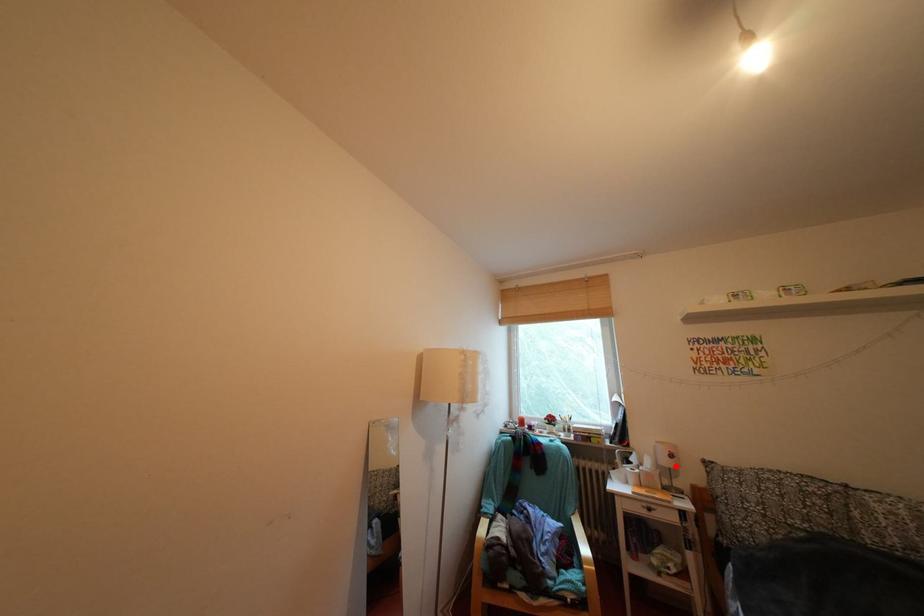
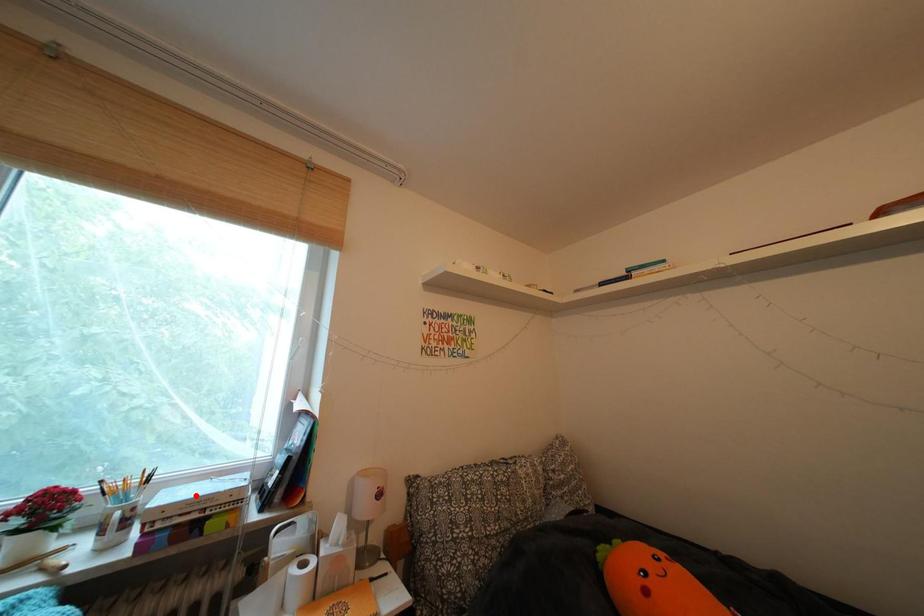
I am providing you with two images of the same scene from different viewpoints. A red point is marked on the first image and another point is marked on the second image. Is the marked point in image1 the same physical position as the marked point in image2?

No